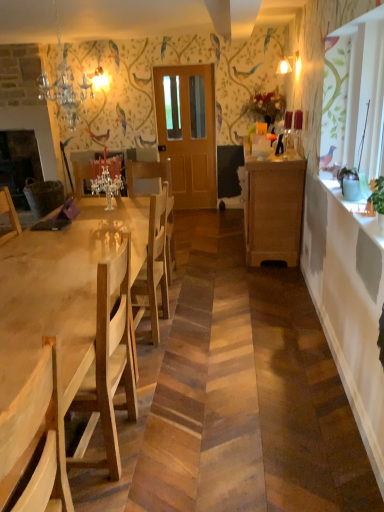
From the picture: What is the approximate width of light brown wooden door at center?

11.71 centimeters.

What do you see at coordinates (65, 84) in the screenshot? The image size is (384, 512). I see `crystal glass chandelier at upper left, acting as the 2th lamp starting from the back` at bounding box center [65, 84].

Locate an element on the screen. crystal glass chandelier at upper left, which ranks as the 2th lamp in right-to-left order is located at coordinates (65, 84).

What do you see at coordinates (274, 208) in the screenshot? Image resolution: width=384 pixels, height=512 pixels. I see `wooden cabinet at right` at bounding box center [274, 208].

What are the coordinates of `light brown wooden door at center` in the screenshot? It's located at (188, 132).

Can you confirm if light brown wooden door at center is smaller than white glossy counter top at upper right?

Actually, light brown wooden door at center might be larger than white glossy counter top at upper right.

Based on the photo, is light brown wooden door at center closer to the viewer compared to white glossy counter top at upper right?

No, light brown wooden door at center is behind white glossy counter top at upper right.

Are light brown wooden door at center and white glossy counter top at upper right beside each other?

light brown wooden door at center and white glossy counter top at upper right are clearly separated.

Is light brown wooden door at center not close to wooden cabinet at right?

Yes, light brown wooden door at center is far from wooden cabinet at right.

Is light brown wooden door at center looking in the opposite direction of wooden cabinet at right?

No.

Where is `door above the wooden cabinet at right (from a real-world perspective)`? The image size is (384, 512). door above the wooden cabinet at right (from a real-world perspective) is located at coordinates (188, 132).

Is wooden cabinet at right surrounded by light brown wooden door at center?

No.

From the picture: How much distance is there between crystal glass chandelier at upper left, positioned as the 1th lamp in front-to-back order, and white glossy counter top at upper right?

2.89 meters.

Can you confirm if crystal glass chandelier at upper left, acting as the 2th lamp starting from the back, is bigger than white glossy counter top at upper right?

Yes, crystal glass chandelier at upper left, acting as the 2th lamp starting from the back, is bigger than white glossy counter top at upper right.

Is crystal glass chandelier at upper left, which is the 1th lamp in left-to-right order, not within white glossy counter top at upper right?

Yes.

Which object is thinner, crystal glass chandelier at upper left, positioned as the 1th lamp in front-to-back order, or white glossy counter top at upper right?

With smaller width is white glossy counter top at upper right.

From the picture: Does light wood table at center lie in front of wooden cabinet at right?

Yes, light wood table at center is in front of wooden cabinet at right.

Would you say light wood table at center is a long distance from wooden cabinet at right?

Yes, light wood table at center and wooden cabinet at right are located far from each other.

Is wooden cabinet at right inside light wood table at center?

Actually, wooden cabinet at right is outside light wood table at center.

Who is taller, white glossy counter top at upper right or wooden cabinet at right?

wooden cabinet at right.

The width and height of the screenshot is (384, 512). I want to click on cabinetry beneath the white glossy counter top at upper right (from a real-world perspective), so click(274, 208).

Which object is further away from the camera taking this photo, white glossy counter top at upper right or wooden cabinet at right?

wooden cabinet at right is more distant.

Considering the sizes of objects white glossy counter top at upper right and wooden cabinet at right in the image provided, who is wider, white glossy counter top at upper right or wooden cabinet at right?

wooden cabinet at right is wider.

Does crystal glass chandelier at upper left, acting as the 2th lamp starting from the back, have a greater height compared to light wood table at center?

Correct, crystal glass chandelier at upper left, acting as the 2th lamp starting from the back, is much taller as light wood table at center.

From a real-world perspective, which is physically above, crystal glass chandelier at upper left, the 1th lamp ordered from the bottom, or light wood table at center?

From a 3D spatial view, crystal glass chandelier at upper left, the 1th lamp ordered from the bottom, is above.

Is crystal glass chandelier at upper left, which ranks as the 2th lamp in right-to-left order, touching light wood table at center?

There is a gap between crystal glass chandelier at upper left, which ranks as the 2th lamp in right-to-left order, and light wood table at center.

From the image's perspective, is wooden cabinet at right located beneath light brown wooden door at center?

Yes, from the image's perspective, wooden cabinet at right is below light brown wooden door at center.

In order to click on door on the left of wooden cabinet at right in this screenshot , I will do `click(188, 132)`.

Looking at this image, looking at the image, does wooden cabinet at right seem bigger or smaller compared to light brown wooden door at center?

Clearly, wooden cabinet at right is larger in size than light brown wooden door at center.

Can you see wooden cabinet at right touching light brown wooden door at center?

No, wooden cabinet at right is not making contact with light brown wooden door at center.

Locate an element on the screen. door above the white glossy counter top at upper right (from a real-world perspective) is located at coordinates (188, 132).

Locate an element on the screen. cabinetry below the light brown wooden door at center (from a real-world perspective) is located at coordinates (274, 208).

From the image, which object appears to be nearer to wooden cabinet at right, matte glass lampshade at upper center, arranged as the 1th lamp when viewed from the right, or crystal glass chandelier at upper left, which ranks as the 2th lamp in right-to-left order?

matte glass lampshade at upper center, arranged as the 1th lamp when viewed from the right, is closer to wooden cabinet at right.

Based on their spatial positions, is light brown wooden door at center or light wood chair at left further from matte glass lampshade at upper center, which is the 2th lamp from bottom to top?

light wood chair at left is further to matte glass lampshade at upper center, which is the 2th lamp from bottom to top.

Estimate the real-world distances between objects in this image. Which object is closer to white glossy counter top at upper right, light brown wooden door at center or crystal glass chandelier at upper left, which is counted as the 2th lamp, starting from the top?

The object closer to white glossy counter top at upper right is light brown wooden door at center.

Based on their spatial positions, is matte glass lampshade at upper center, which is the 2th lamp from bottom to top, or wooden cabinet at right closer to crystal glass chandelier at upper left, which is the 1th lamp in left-to-right order?

wooden cabinet at right is closer to crystal glass chandelier at upper left, which is the 1th lamp in left-to-right order.

Looking at the image, which one is located closer to light brown wooden door at center, matte glass lampshade at upper center, the 1th lamp in the back-to-front sequence, or crystal glass chandelier at upper left, positioned as the 1th lamp in front-to-back order?

crystal glass chandelier at upper left, positioned as the 1th lamp in front-to-back order, is closer to light brown wooden door at center.

Which object lies further to the anchor point light wood chair at left, wooden cabinet at right or crystal glass chandelier at upper left, which ranks as the 2th lamp in right-to-left order?

crystal glass chandelier at upper left, which ranks as the 2th lamp in right-to-left order, lies further to light wood chair at left than the other object.

Which object lies further to the anchor point light wood table at center, matte glass lampshade at upper center, the second lamp when ordered from front to back, or crystal glass chandelier at upper left, which ranks as the 2th lamp in right-to-left order?

matte glass lampshade at upper center, the second lamp when ordered from front to back, is further to light wood table at center.

Estimate the real-world distances between objects in this image. Which object is further from light brown wooden door at center, wooden cabinet at right or white glossy counter top at upper right?

white glossy counter top at upper right is positioned further to the anchor light brown wooden door at center.

The image size is (384, 512). Find the location of `counter top between light wood table at center and wooden cabinet at right from front to back`. counter top between light wood table at center and wooden cabinet at right from front to back is located at coordinates (x=356, y=210).

Find the location of `desk between light wood chair at left and wooden cabinet at right in the front-back direction`. desk between light wood chair at left and wooden cabinet at right in the front-back direction is located at coordinates pyautogui.click(x=61, y=289).

Where is `desk that lies between crystal glass chandelier at upper left, which ranks as the 2th lamp in right-to-left order, and light wood chair at left from top to bottom`? desk that lies between crystal glass chandelier at upper left, which ranks as the 2th lamp in right-to-left order, and light wood chair at left from top to bottom is located at coordinates (61, 289).

Image resolution: width=384 pixels, height=512 pixels. In order to click on counter top located between light wood chair at left and light brown wooden door at center in the depth direction in this screenshot , I will do `click(356, 210)`.